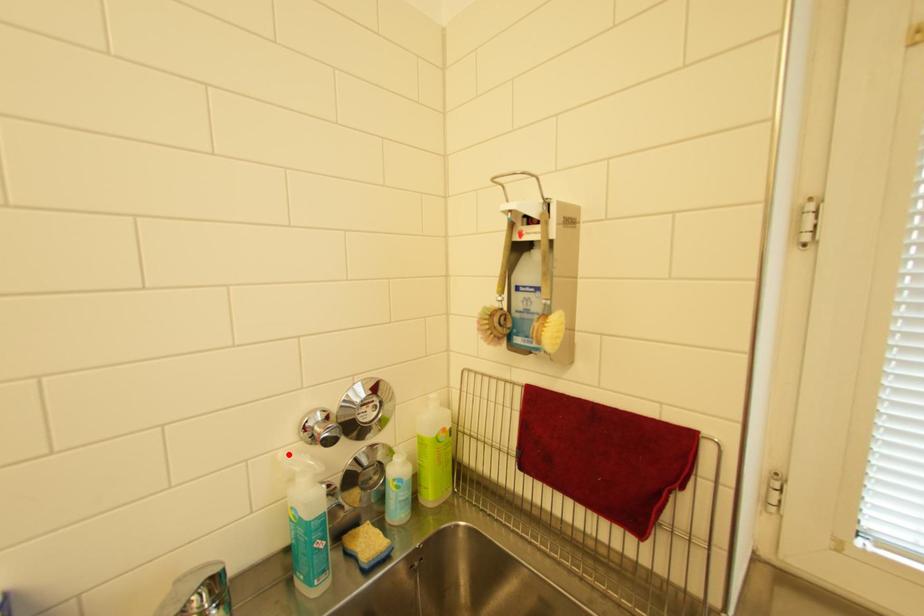
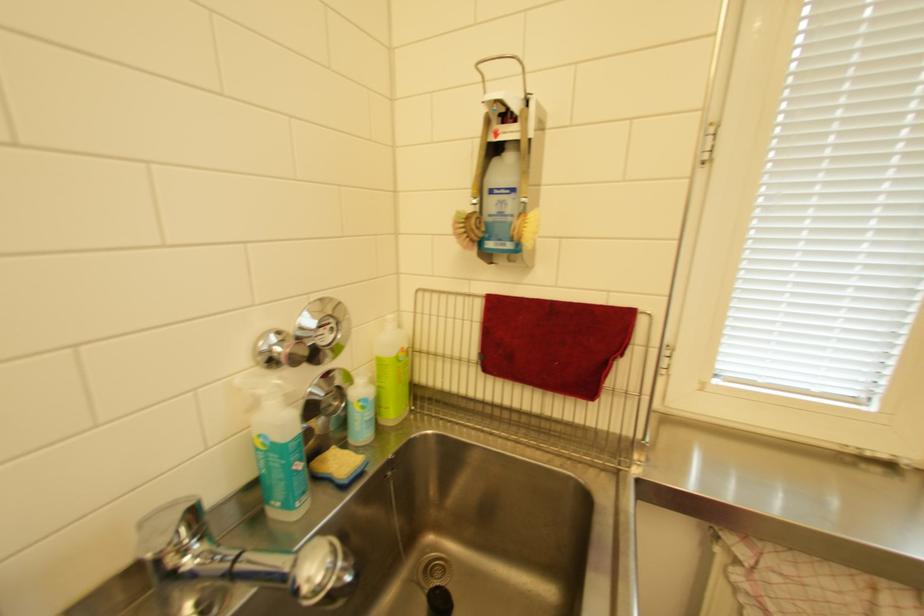
Locate, in the second image, the point that corresponds to the highlighted location in the first image.

(244, 379)